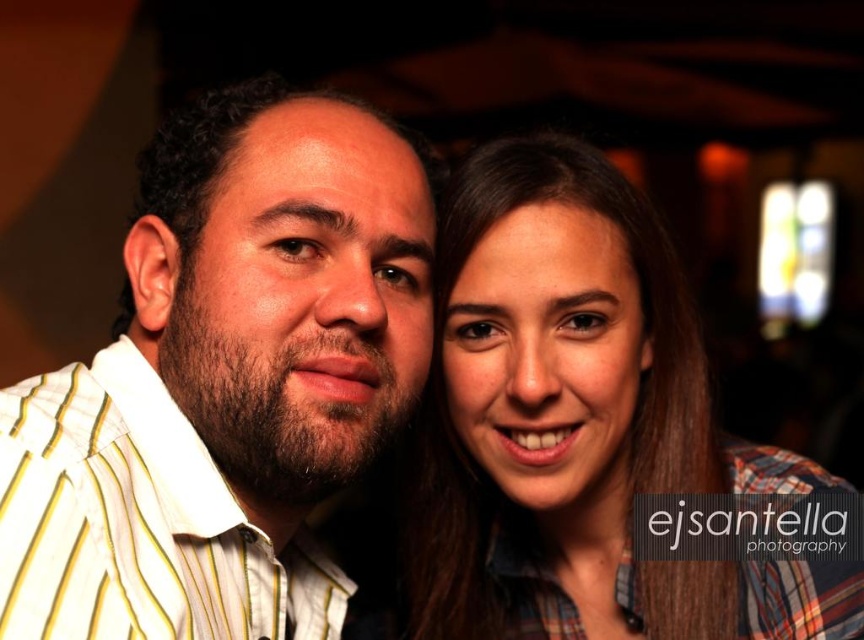
Is white striped shirt at center above plaid shirt at center?

Yes, white striped shirt at center is above plaid shirt at center.

Does point (122, 339) come farther from viewer compared to point (413, 483)?

No, (122, 339) is closer to viewer.

Find the location of a particular element. Image resolution: width=864 pixels, height=640 pixels. white striped shirt at center is located at coordinates (224, 381).